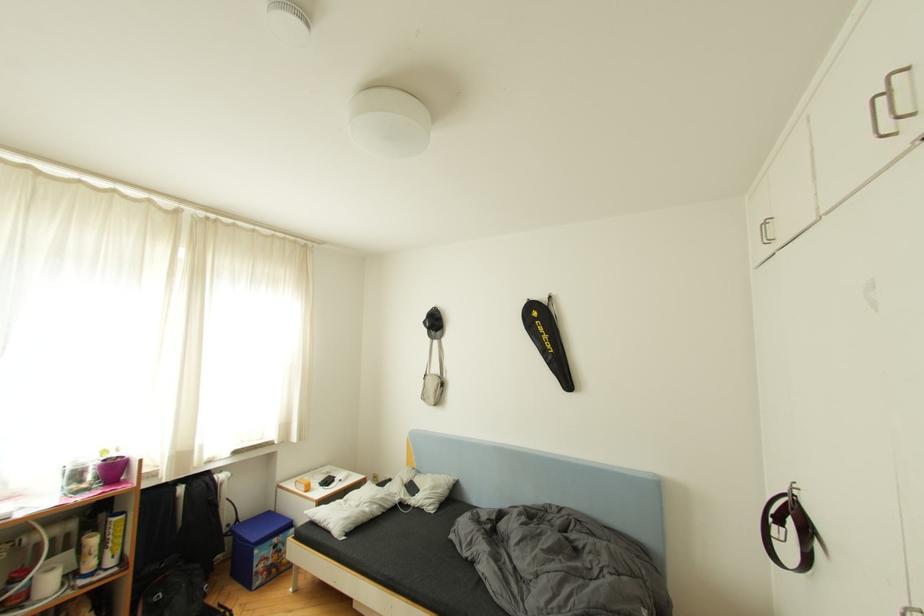
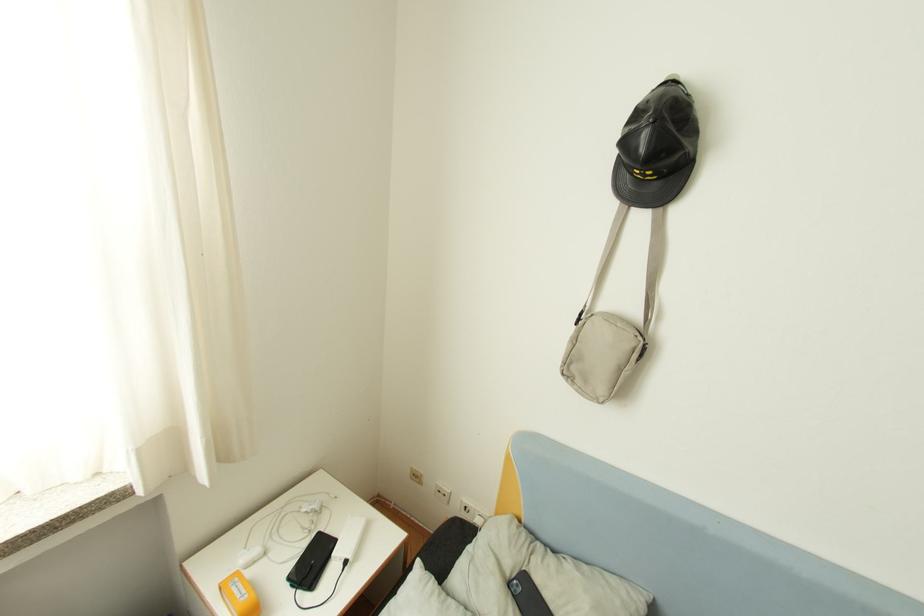
Question: What movement of the cameraman would produce the second image?

Choices:
 (A) Left
 (B) Right
 (C) Forward
 (D) Backward

Answer: (C)